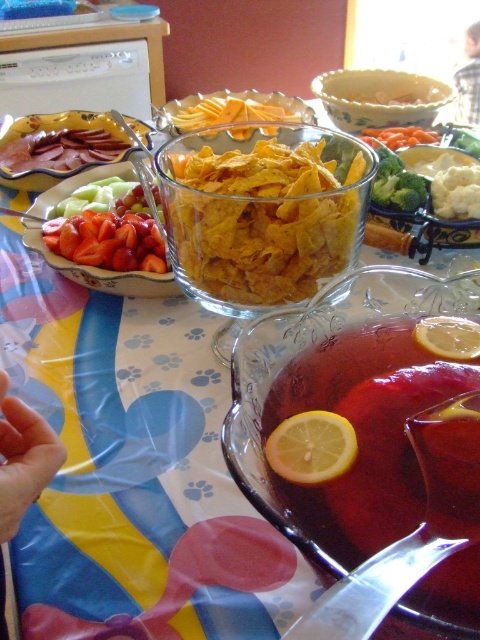
Looking at this image, you are at a party and want to grab a drink from the punch bowl. You notice two points on the table. One is at coordinate point (x=375, y=477) and the other is at point (x=131, y=195). Which point is closer to you?

Point (x=375, y=477) is closer to the camera than point (x=131, y=195), so the point at (x=375, y=477) is closer to you.

You are sitting at the table and want to reach both the punch bowl and the food items. Which point, point 1 at coordinates [348,250] or point 2 at coordinates [445,216], is closer to you?

Point 1 at coordinates [348,250] is closer to you because it is in front of point 2 at coordinates [445,216].